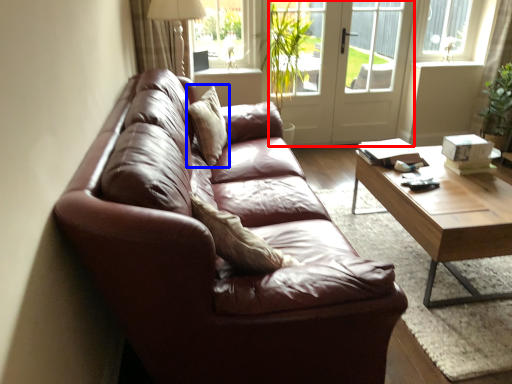
Question: Among these objects, which one is nearest to the camera, screen door (highlighted by a red box) or pillow (highlighted by a blue box)?

Choices:
 (A) screen door
 (B) pillow

Answer: (B)